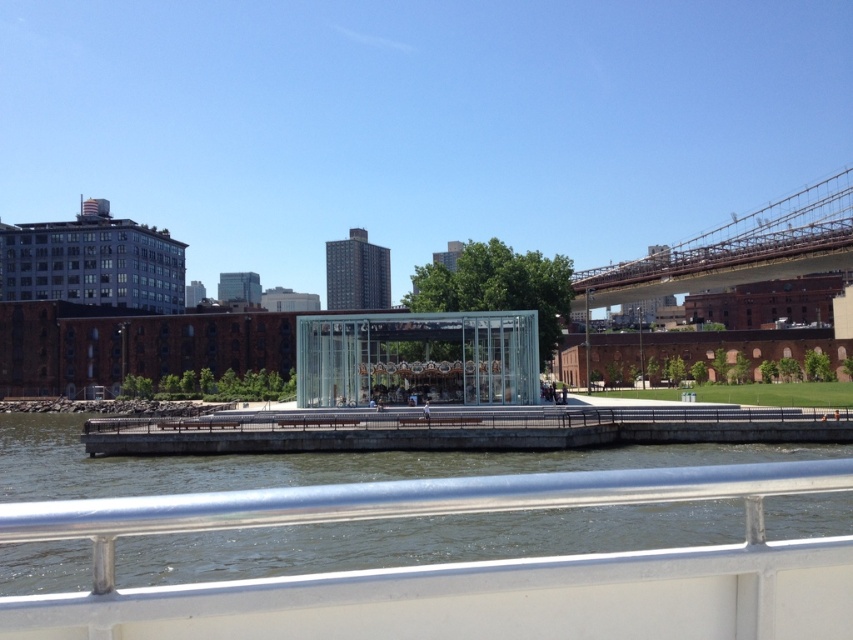
From the picture: You are a tour guide explaining the distance between the greenish water at lower center and the transparent glass carousel at center to a tourist. How far apart are these two attractions?

The greenish water at lower center and the transparent glass carousel at center are 14.35 meters apart.

You are standing on the boat and looking at the greenish water at lower center and the brown wooden bridge at upper right. Which object is taller from your perspective?

The brown wooden bridge at upper right is taller than the greenish water at lower center.

You are a photographer planning to capture the entire scene in one shot. The greenish water at lower center and the transparent glass carousel at center are both important elements. Based on their widths, which object should you prioritize framing first to ensure it fits within the camera frame?

The greenish water at lower center has a greater width than the transparent glass carousel at center, so you should prioritize framing the greenish water at lower center first to ensure it fits within the camera frame.